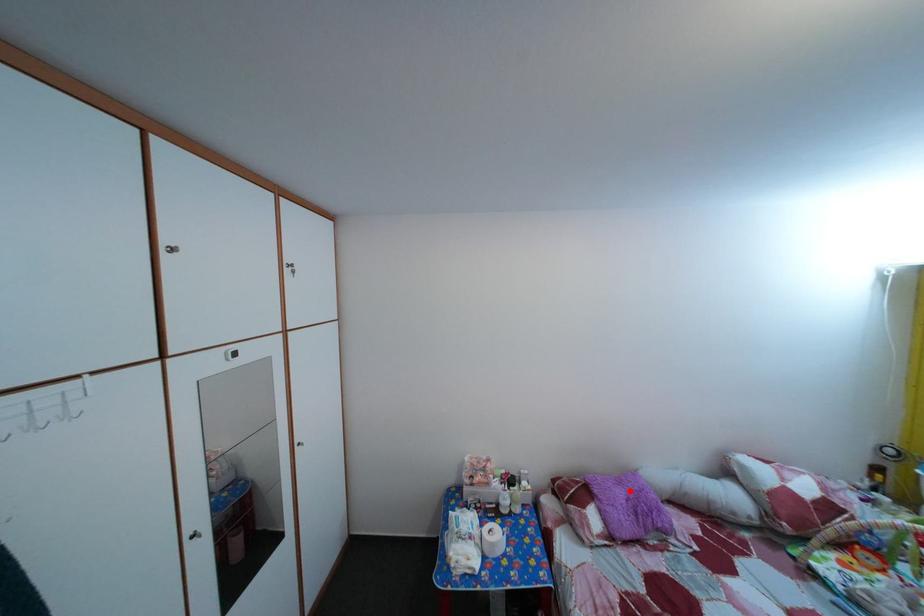
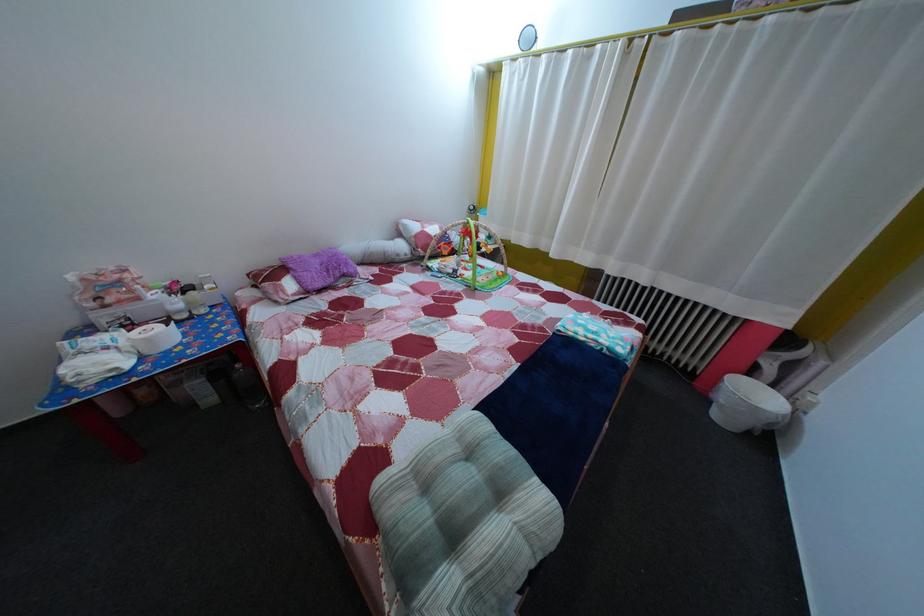
The point at the highlighted location is marked in the first image. Where is the corresponding point in the second image?

(325, 262)